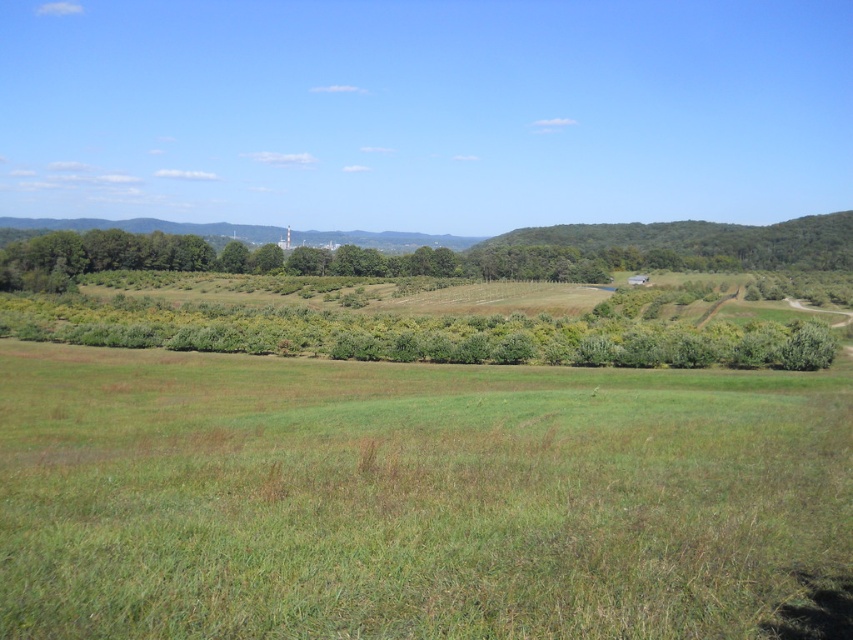
Question: Does green grassy field at center appear on the left side of green leafy trees at center?

Choices:
 (A) yes
 (B) no

Answer: (B)

Question: Among these points, which one is farthest from the camera?

Choices:
 (A) (68, 561)
 (B) (573, 259)

Answer: (B)

Question: Where is green grassy field at center located in relation to green leafy trees at center in the image?

Choices:
 (A) above
 (B) below

Answer: (B)

Question: Is green grassy field at center bigger than green leafy trees at center?

Choices:
 (A) yes
 (B) no

Answer: (B)